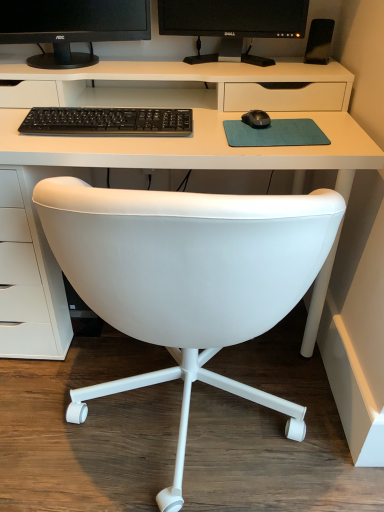
Measure the distance between teal fabric mousepad at center and camera.

1.00 meters.

You are a GUI agent. You are given a task and a screenshot of the screen. Output one action in this format:
    pyautogui.click(x=<x>, y=<y>)
    Task: Click on the black glossy monitor at upper center, which ranks as the 1th computer monitor in right-to-left order
    
    Given the screenshot: What is the action you would take?
    pyautogui.click(x=233, y=24)

This screenshot has height=512, width=384. Identify the location of black matte speaker at upper right. (319, 41).

Looking at this image, is black matte keyboard at center completely or partially inside black glossy monitor at upper center, which is the second computer monitor in left-to-right order?

No.

Is black glossy monitor at upper center, which ranks as the 1th computer monitor in right-to-left order, far from black matte keyboard at center?

No, black glossy monitor at upper center, which ranks as the 1th computer monitor in right-to-left order, is not far away from black matte keyboard at center.

From a real-world perspective, is black glossy monitor at upper center, which ranks as the 1th computer monitor in right-to-left order, positioned over black matte keyboard at center based on gravity?

Yes, from a real-world perspective, black glossy monitor at upper center, which ranks as the 1th computer monitor in right-to-left order, is above black matte keyboard at center.

Which object is further away from the camera, black glossy monitor at upper center, which is the second computer monitor in left-to-right order, or black matte keyboard at center?

black glossy monitor at upper center, which is the second computer monitor in left-to-right order, is more distant.

Based on the photo, which point is more forward, (114, 13) or (329, 48)?

The point (114, 13) is in front.

Consider the image. Is black matte monitor at upper center, arranged as the second computer monitor when viewed from the right, completely or partially outside of black matte speaker at upper right?

black matte monitor at upper center, arranged as the second computer monitor when viewed from the right, lies outside black matte speaker at upper right's area.

Which object is wider, black matte monitor at upper center, arranged as the second computer monitor when viewed from the right, or black matte speaker at upper right?

Wider between the two is black matte monitor at upper center, arranged as the second computer monitor when viewed from the right.

Can you confirm if black matte monitor at upper center, arranged as the second computer monitor when viewed from the right, is taller than black matte speaker at upper right?

Indeed, black matte monitor at upper center, arranged as the second computer monitor when viewed from the right, has a greater height compared to black matte speaker at upper right.

Who is bigger, white leather chair at center or black glossy monitor at upper center, which is the second computer monitor in left-to-right order?

Bigger between the two is white leather chair at center.

From the picture: Visually, is white leather chair at center positioned to the left or to the right of black glossy monitor at upper center, which is the second computer monitor in left-to-right order?

Clearly, white leather chair at center is on the left of black glossy monitor at upper center, which is the second computer monitor in left-to-right order, in the image.

From the picture: Which object is thinner, white leather chair at center or black glossy monitor at upper center, which is the second computer monitor in left-to-right order?

With smaller width is black glossy monitor at upper center, which is the second computer monitor in left-to-right order.

Does teal fabric mousepad at center turn towards black matte speaker at upper right?

No.

Is teal fabric mousepad at center spatially inside black matte speaker at upper right, or outside of it?

teal fabric mousepad at center is located beyond the bounds of black matte speaker at upper right.

The height and width of the screenshot is (512, 384). What are the coordinates of `mousepad located in front of the black matte speaker at upper right` in the screenshot? It's located at (275, 133).

Considering the relative positions of teal fabric mousepad at center and black matte speaker at upper right in the image provided, is teal fabric mousepad at center to the left or to the right of black matte speaker at upper right?

In the image, teal fabric mousepad at center appears on the left side of black matte speaker at upper right.

Between white plastic desk at center and black matte monitor at upper center, arranged as the second computer monitor when viewed from the right, which one appears on the right side from the viewer's perspective?

white plastic desk at center is more to the right.

From a real-world perspective, is white plastic desk at center on black matte monitor at upper center, arranged as the second computer monitor when viewed from the right?

No, from a real-world perspective, white plastic desk at center is not above black matte monitor at upper center, arranged as the second computer monitor when viewed from the right.

How distant is white plastic desk at center from black matte monitor at upper center, arranged as the second computer monitor when viewed from the right?

12.39 inches.

Is white plastic desk at center oriented away from black matte monitor at upper center, arranged as the second computer monitor when viewed from the right?

That's not correct — white plastic desk at center is not looking away from black matte monitor at upper center, arranged as the second computer monitor when viewed from the right.

From the image's perspective, who appears lower, teal fabric mousepad at center or white leather chair at center?

white leather chair at center.

Between teal fabric mousepad at center and white leather chair at center, which one has larger width?

With larger width is white leather chair at center.

Is teal fabric mousepad at center taller or shorter than white leather chair at center?

Considering their sizes, teal fabric mousepad at center has less height than white leather chair at center.

Is teal fabric mousepad at center positioned beyond the bounds of white leather chair at center?

Actually, teal fabric mousepad at center is within white leather chair at center.

From the image's perspective, is black glossy monitor at upper center, which ranks as the 1th computer monitor in right-to-left order, under white leather chair at center?

Actually, black glossy monitor at upper center, which ranks as the 1th computer monitor in right-to-left order, appears above white leather chair at center in the image.

Which object is further away from the camera taking this photo, black glossy monitor at upper center, which ranks as the 1th computer monitor in right-to-left order, or white leather chair at center?

black glossy monitor at upper center, which ranks as the 1th computer monitor in right-to-left order, is behind.

Can you tell me how much black glossy monitor at upper center, which is the second computer monitor in left-to-right order, and white leather chair at center differ in facing direction?

black glossy monitor at upper center, which is the second computer monitor in left-to-right order, and white leather chair at center are facing 169 degrees away from each other.

From a real-world perspective, does black glossy monitor at upper center, which is the second computer monitor in left-to-right order, stand above white leather chair at center?

Yes, from a real-world perspective, black glossy monitor at upper center, which is the second computer monitor in left-to-right order, is on top of white leather chair at center.

This screenshot has width=384, height=512. Identify the location of computer keyboard that is below the black glossy monitor at upper center, which is the second computer monitor in left-to-right order (from the image's perspective). (107, 122).

At what (x,y) coordinates should I click in order to perform the action: click on the 2nd computer monitor to the left when counting from the black matte speaker at upper right. Please return your answer as a coordinate pair (x, y). The width and height of the screenshot is (384, 512). Looking at the image, I should click on (72, 27).

From the image, which object appears to be farther from black glossy monitor at upper center, which is the second computer monitor in left-to-right order, white leather chair at center or black matte speaker at upper right?

white leather chair at center is positioned further to the anchor black glossy monitor at upper center, which is the second computer monitor in left-to-right order.

Considering their positions, is black matte speaker at upper right positioned further to black matte monitor at upper center, the first computer monitor viewed from the left, than white plastic desk at center?

The object further to black matte monitor at upper center, the first computer monitor viewed from the left, is black matte speaker at upper right.

Estimate the real-world distances between objects in this image. Which object is further from white plastic desk at center, black matte monitor at upper center, the first computer monitor viewed from the left, or black matte keyboard at center?

Based on the image, black matte monitor at upper center, the first computer monitor viewed from the left, appears to be further to white plastic desk at center.

When comparing their distances from black matte speaker at upper right, does white plastic desk at center or teal fabric mousepad at center seem closer?

teal fabric mousepad at center lies closer to black matte speaker at upper right than the other object.

Looking at the image, which one is located closer to white plastic desk at center, teal fabric mousepad at center or black matte keyboard at center?

black matte keyboard at center is closer to white plastic desk at center.

From the image, which object appears to be nearer to black matte keyboard at center, teal fabric mousepad at center or black glossy monitor at upper center, which is the second computer monitor in left-to-right order?

The object closer to black matte keyboard at center is teal fabric mousepad at center.

Considering their positions, is white leather chair at center positioned further to white plastic desk at center than teal fabric mousepad at center?

Among the two, white leather chair at center is located further to white plastic desk at center.

Looking at the image, which one is located closer to teal fabric mousepad at center, white leather chair at center or black glossy monitor at upper center, which ranks as the 1th computer monitor in right-to-left order?

Among the two, white leather chair at center is located nearer to teal fabric mousepad at center.

Locate an element on the screen. computer keyboard between black matte monitor at upper center, the first computer monitor viewed from the left, and white plastic desk at center, in the vertical direction is located at coordinates (107, 122).

Locate an element on the screen. desk between black matte speaker at upper right and white leather chair at center from top to bottom is located at coordinates (146, 159).

This screenshot has height=512, width=384. In order to click on speaker between black glossy monitor at upper center, which ranks as the 1th computer monitor in right-to-left order, and teal fabric mousepad at center in the up-down direction in this screenshot , I will do `click(319, 41)`.

At what (x,y) coordinates should I click in order to perform the action: click on desk between black matte monitor at upper center, the first computer monitor viewed from the left, and black matte speaker at upper right. Please return your answer as a coordinate pair (x, y). The height and width of the screenshot is (512, 384). Looking at the image, I should click on (146, 159).